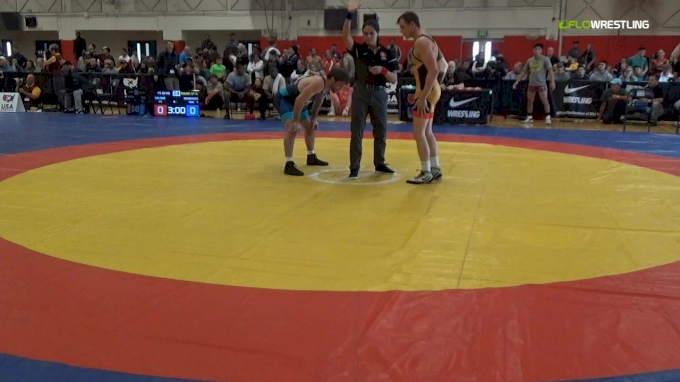
The width and height of the screenshot is (680, 382). What are the coordinates of `wrestling mat` in the screenshot? It's located at tap(423, 266).